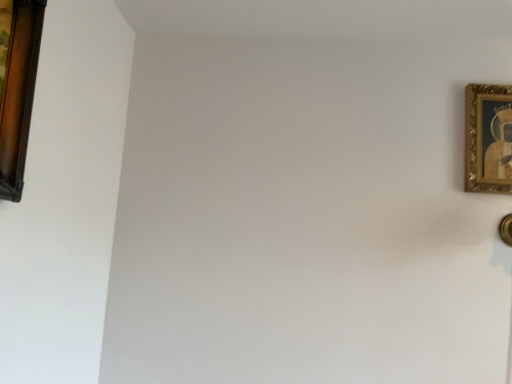
This screenshot has width=512, height=384. I want to click on gold/gilded picture frame at upper right, so click(x=488, y=139).

What do you see at coordinates (488, 139) in the screenshot? The height and width of the screenshot is (384, 512). I see `gold/gilded picture frame at upper right` at bounding box center [488, 139].

Where is `gold/gilded picture frame at upper right`? gold/gilded picture frame at upper right is located at coordinates (488, 139).